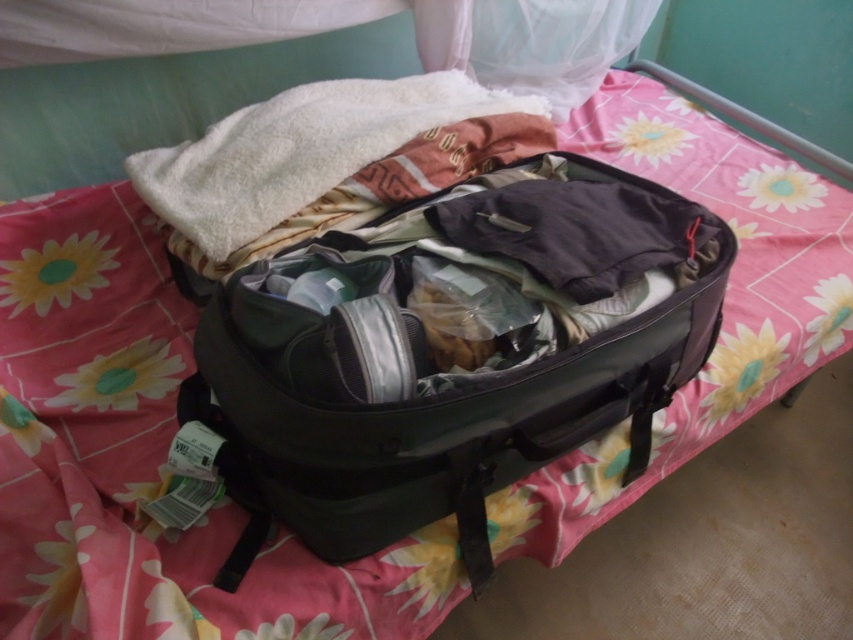
In the scene shown: You are packing for a trip and need to know if the white fluffy towel at center will fit inside the black fabric suitcase at center. Based on their positions in the image, can you determine if the towel will fit?

The black fabric suitcase at center is below the white fluffy towel at center, which means the towel is on top of the suitcase. Since the towel is not inside the suitcase, its size relative to the suitcase isn their position doesn indicate whether it will fit inside.